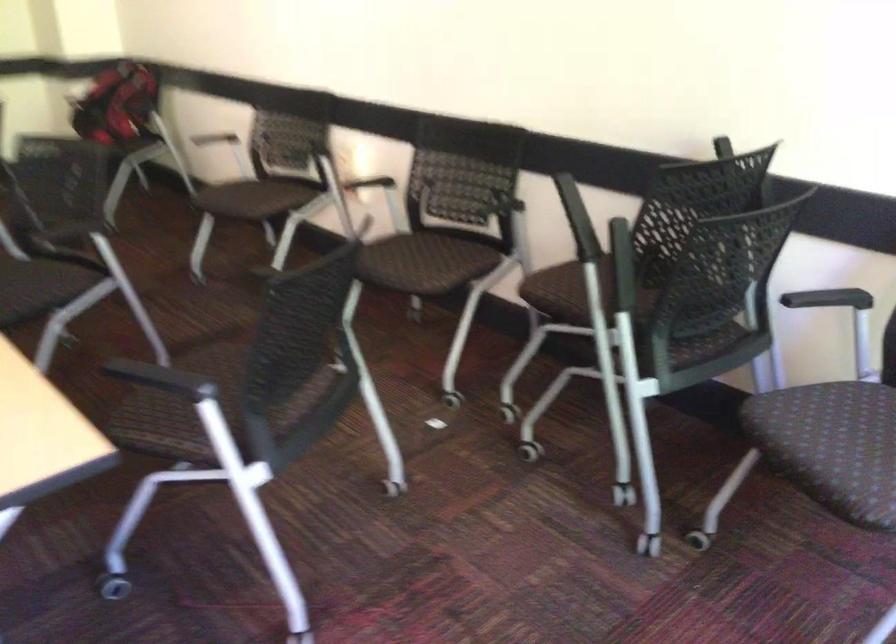
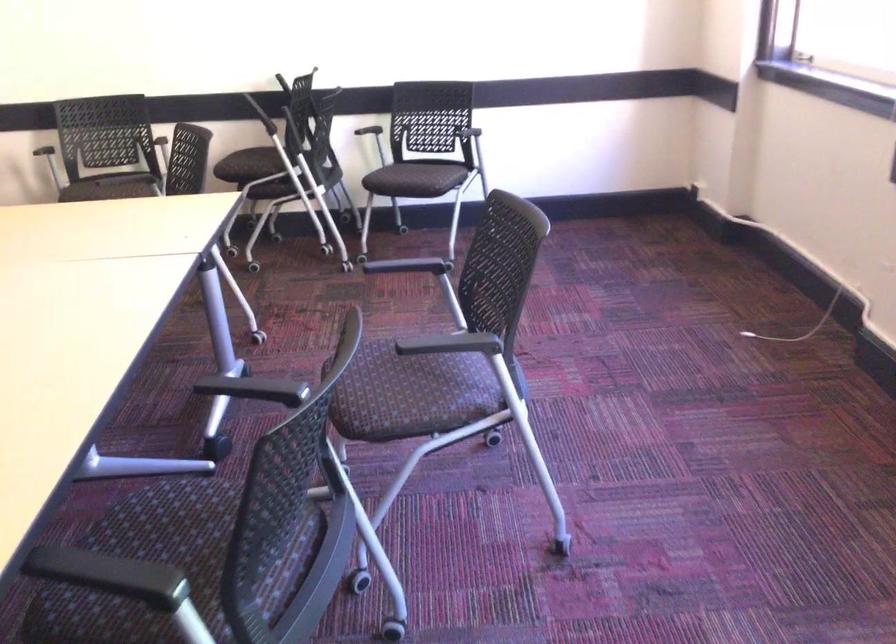
The point at (572,308) is marked in the first image. Where is the corresponding point in the second image?

(252, 166)